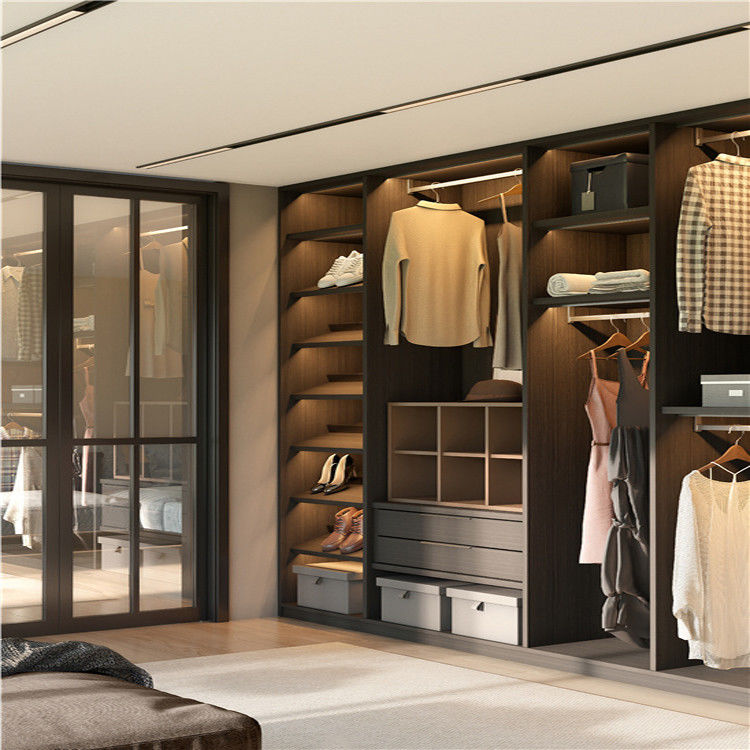
The image size is (750, 750). In order to click on area rug in this screenshot , I will do `click(457, 716)`.